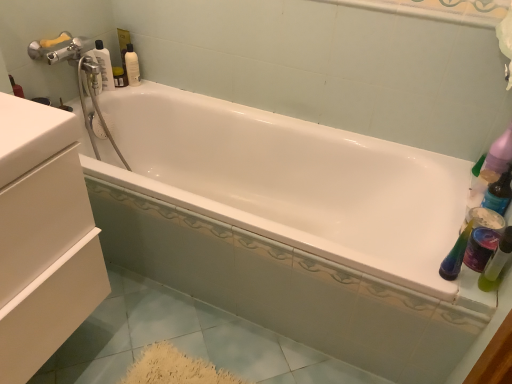
Question: From the image's perspective, is green translucent bottle at right, positioned as the second mouthwash in top-to-bottom order, above or below white matte drawer at left?

Choices:
 (A) below
 (B) above

Answer: (A)

Question: From a real-world perspective, relative to white matte drawer at left, is green translucent bottle at right, the first mouthwash when ordered from right to left, vertically above or below?

Choices:
 (A) below
 (B) above

Answer: (B)

Question: Which is nearer to the green translucent bottle at right, the first mouthwash when ordered from right to left?

Choices:
 (A) white glossy mouthwash at upper left, the second mouthwash in the right-to-left sequence
 (B) white matte drawer at left
 (C) transparent plastic bottle at upper left

Answer: (B)

Question: Which is nearer to the green translucent bottle at right, positioned as the second mouthwash in top-to-bottom order?

Choices:
 (A) transparent plastic bottle at upper left
 (B) white matte drawer at left
 (C) white glossy mouthwash at upper left, acting as the second mouthwash starting from the front

Answer: (B)